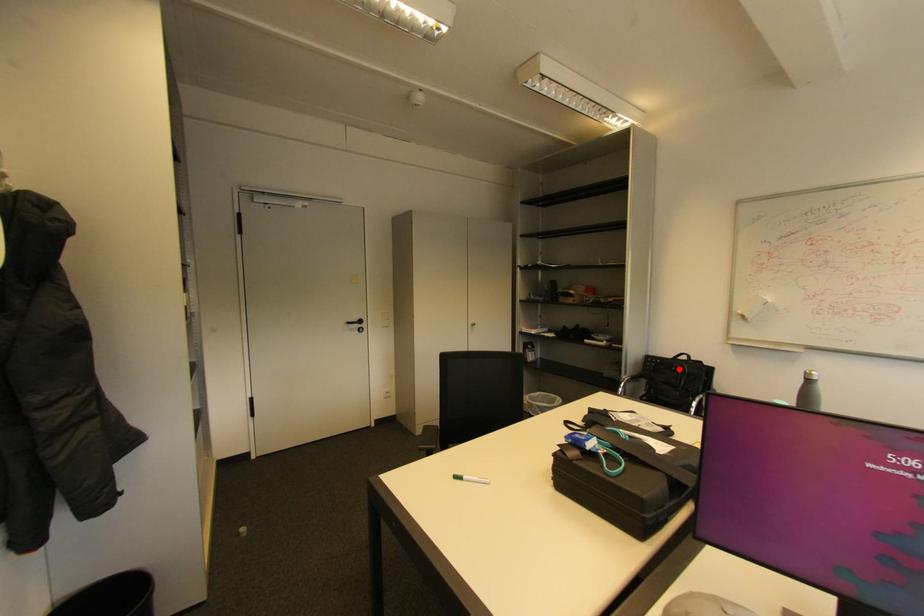
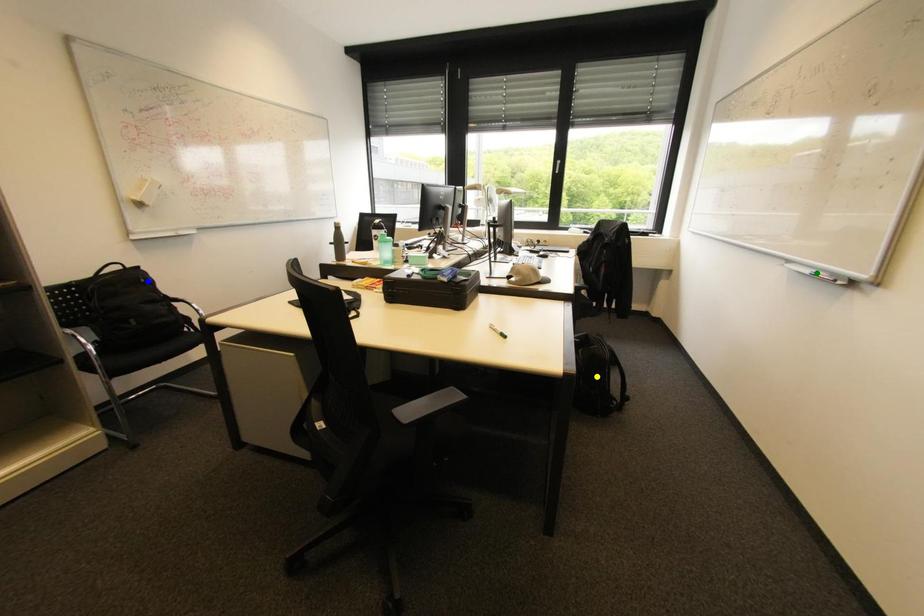
Question: I am providing you with two images of the same scene from different viewpoints. A red point is marked on the first image. You are given multiple points on the second image. Which mark in image 2 goes with the point in image 1?

Choices:
 (A) green point
 (B) yellow point
 (C) blue point

Answer: (C)